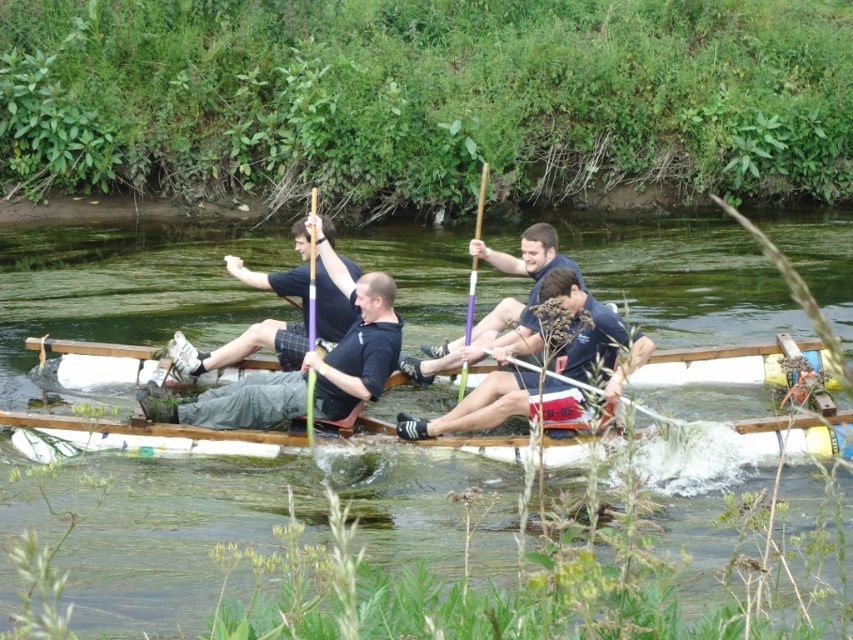
Question: Which point is farther from the camera taking this photo?

Choices:
 (A) (311, 278)
 (B) (86, 372)
 (C) (804, 518)
 (D) (572, 381)

Answer: (B)

Question: Is blue fabric rower at center further to camera compared to purple wood paddle at center?

Choices:
 (A) yes
 (B) no

Answer: (B)

Question: Does black matte shirt at center lie in front of purple wood paddle at center?

Choices:
 (A) no
 (B) yes

Answer: (B)

Question: Is white plastic boat at center wider than wooden paddle at center?

Choices:
 (A) yes
 (B) no

Answer: (A)

Question: Which point is farther to the camera?

Choices:
 (A) (558, 406)
 (B) (310, 410)

Answer: (B)

Question: Estimate the real-world distances between objects in this image. Which object is farther from the white plastic paddle at center?

Choices:
 (A) black matte shirt at center
 (B) purple wood paddle at center
 (C) green translucent water at center

Answer: (C)